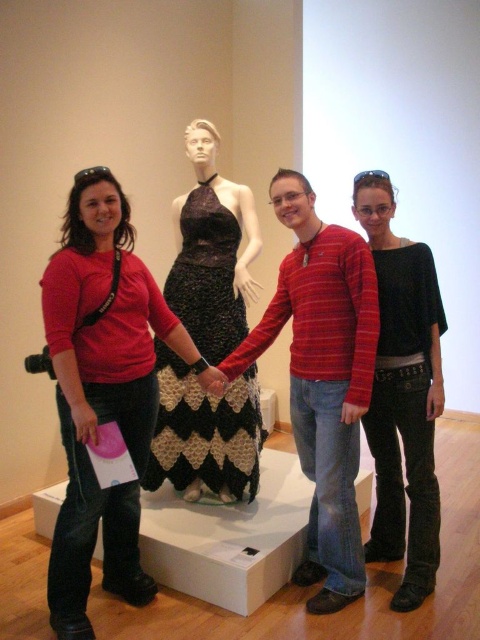
Based on the photo, you are a photographer trying to adjust the lighting for a photo shoot. You have two subjects wearing a matte red shirt at center and a striped cotton shirt at center. Which shirt should you focus the light on to avoid glare, considering their positions?

The striped cotton shirt at center should be focused on because the matte red shirt at center is positioned on its left side, and the light source is on the right, so the striped cotton shirt might reflect more light.

You are a photographer trying to adjust the lighting for a photo shoot. You have two subjects wearing a matte red shirt at center and a black jersey at center. Which subject should you focus on to ensure proper exposure since one is shorter than the other?

The matte red shirt at center is not as tall as the black jersey at center, so you should focus on the black jersey at center to ensure proper exposure.

You are a photographer trying to capture a photo of the black jersey at center and the black crochet dress at center. Which one should you focus on first if you want to ensure both are in focus?

The black jersey at center is taller than the black crochet dress at center, so you should focus on the black jersey at center first to ensure both are in focus.